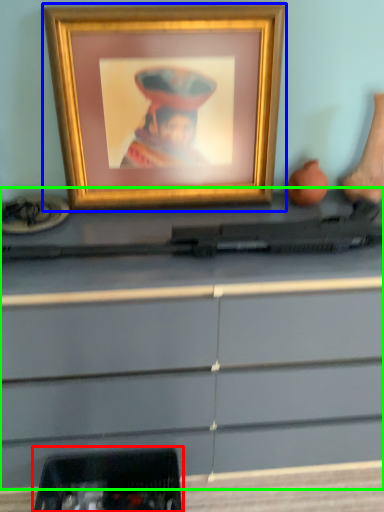
Question: Which object is the closest to the equipment (highlighted by a red box)? Choose among these: picture frame (highlighted by a blue box) or desk (highlighted by a green box).

Choices:
 (A) picture frame
 (B) desk

Answer: (B)